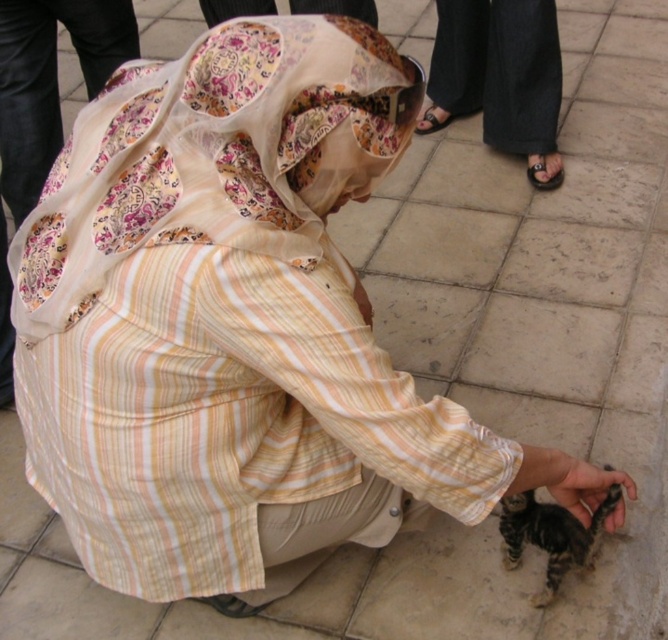
You are a delivery robot that needs to place a package between the floral sheer scarf at center and the black leather sandal at lower right. The package requires a space of 5 feet. Can you fit it there?

The floral sheer scarf at center is 5.32 feet from the black leather sandal at lower right, so yes, the package requiring 5 feet of space can be placed between them as there is sufficient distance.

What is located at the coordinates point (212, 156)?

The floral sheer scarf at center is located at point (212, 156).

You are a delivery robot that is 0.5 meters wide. You need to move from the entrance to the kitchen. There is a black cotton pants at upper center and a striped fur kitten at lower right in your path. Can you pass between them without hitting either?

The black cotton pants at upper center and striped fur kitten at lower right are 1.58 meters apart. Since the robot is 0.5 meters wide, there is enough space between them to pass safely without collision.